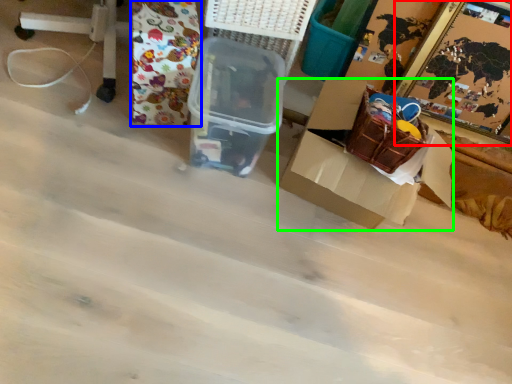
Question: Which object is positioned farthest from picture frame (highlighted by a red box)? Select from wrapping paper (highlighted by a blue box) and box (highlighted by a green box).

Choices:
 (A) wrapping paper
 (B) box

Answer: (A)